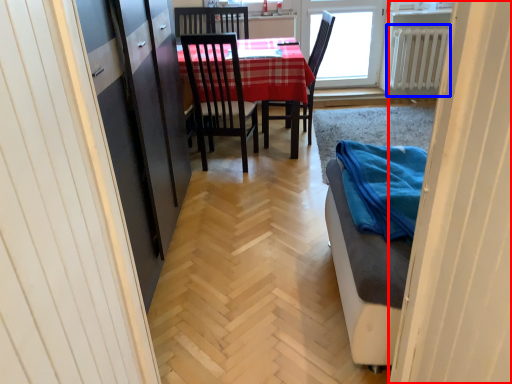
Question: Which of the following is the farthest to the observer, door (highlighted by a red box) or radiator (highlighted by a blue box)?

Choices:
 (A) door
 (B) radiator

Answer: (B)